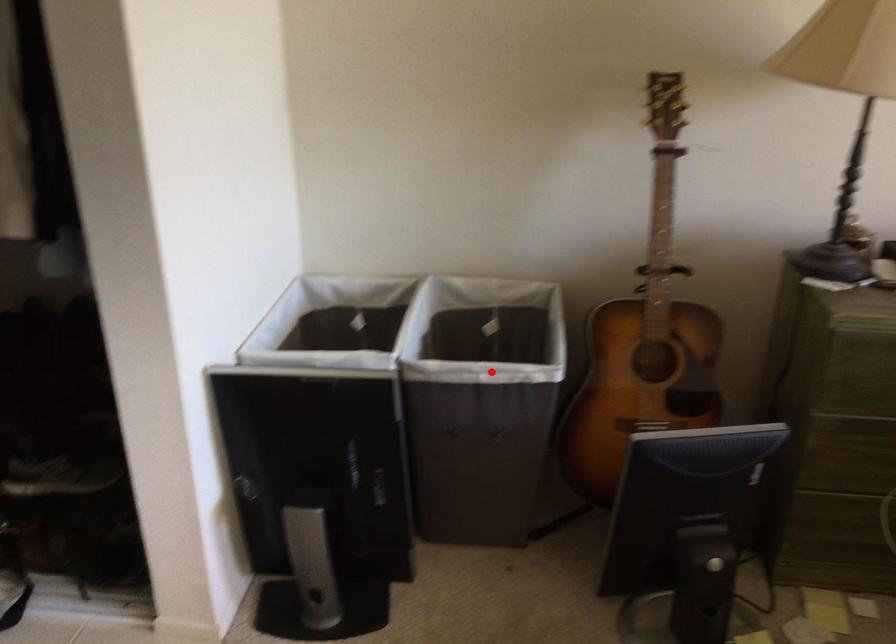
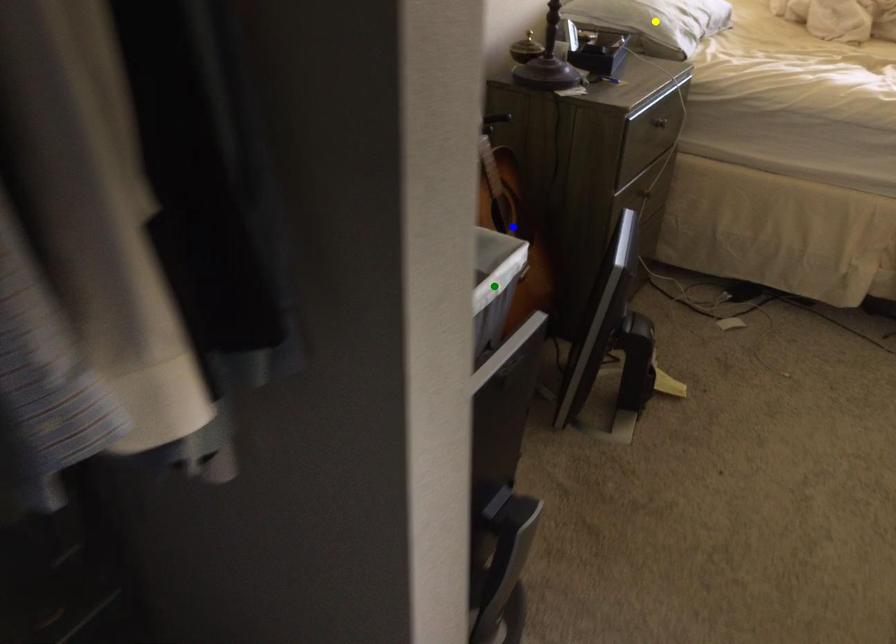
Question: I am providing you with two images of the same scene from different viewpoints. A red point is marked on the first image. You are given multiple points on the second image. Which spot in image 2 lines up with the point in image 1?

Choices:
 (A) yellow point
 (B) blue point
 (C) green point

Answer: (C)